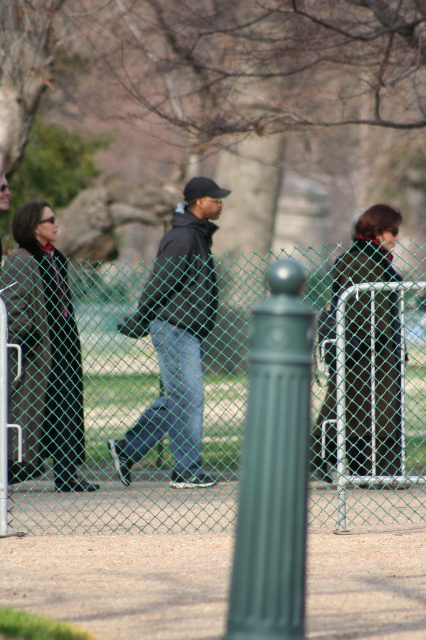
How distant is dark brown leather coat at left from dark blue jeans at center?

A distance of 24.77 inches exists between dark brown leather coat at left and dark blue jeans at center.

What do you see at coordinates (43, 355) in the screenshot? The image size is (426, 640). I see `dark brown leather coat at left` at bounding box center [43, 355].

Where is `dark brown leather coat at left`? The height and width of the screenshot is (640, 426). dark brown leather coat at left is located at coordinates (43, 355).

Does point (261, 492) come farther from viewer compared to point (57, 317)?

No.

Is point (275, 273) behind point (51, 451)?

No, it is in front of (51, 451).

This screenshot has width=426, height=640. Identify the location of green matte pole at center. (273, 467).

Does green matte pole at center have a larger size compared to dark blue jeans at center?

Incorrect, green matte pole at center is not larger than dark blue jeans at center.

Is point (233, 598) more distant than point (160, 406)?

No, it is in front of (160, 406).

This screenshot has height=640, width=426. What are the coordinates of `green matte pole at center` in the screenshot? It's located at (273, 467).